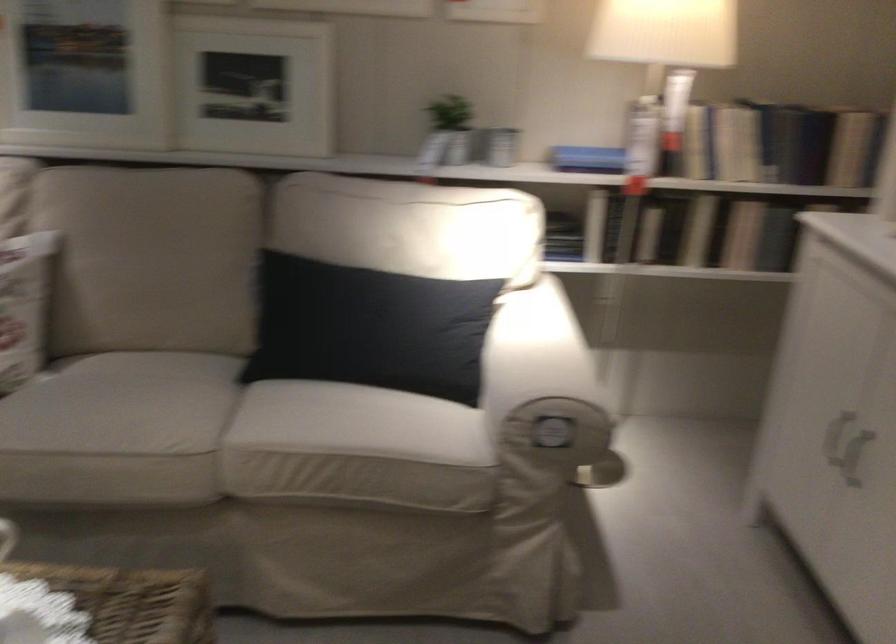
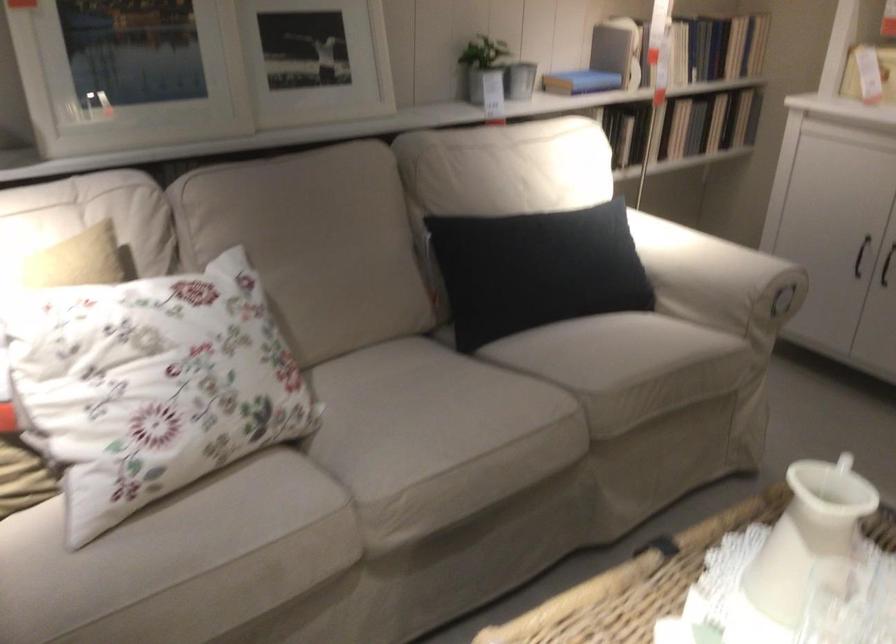
The point at (x=819, y=457) is marked in the first image. Where is the corresponding point in the second image?

(886, 265)